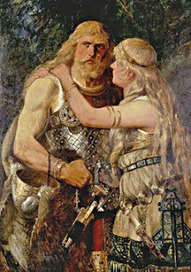
Locate an element on the screen. The height and width of the screenshot is (272, 191). painting: arminius says goodbye to thusnelda is located at coordinates (12, 105).